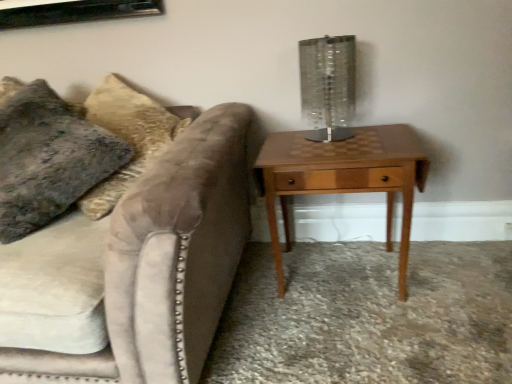
Image resolution: width=512 pixels, height=384 pixels. What do you see at coordinates (49, 158) in the screenshot? I see `velvety gray pillow at left` at bounding box center [49, 158].

What do you see at coordinates (343, 178) in the screenshot?
I see `woodenmaterial/texturenightstand at right` at bounding box center [343, 178].

Identify the location of velvet couch at left. (168, 258).

What do you see at coordinates (328, 86) in the screenshot? I see `clear glass table lamp at upper right` at bounding box center [328, 86].

Where is `velvety gray pillow at left`? The image size is (512, 384). velvety gray pillow at left is located at coordinates (49, 158).

Is woodenmaterial/texturenightstand at right next to clear glass table lamp at upper right?

No, woodenmaterial/texturenightstand at right is not with clear glass table lamp at upper right.

Is woodenmaterial/texturenightstand at right oriented away from clear glass table lamp at upper right?

woodenmaterial/texturenightstand at right does not have its back to clear glass table lamp at upper right.

Which is behind, point (402, 180) or point (333, 44)?

The point (333, 44) is farther from the camera.

Is velvety gray pillow at left facing towards woodenmaterial/texturenightstand at right?

No.

From the image's perspective, is velvety gray pillow at left above woodenmaterial/texturenightstand at right?

Correct, velvety gray pillow at left appears higher than woodenmaterial/texturenightstand at right in the image.

Which is nearer, (8, 137) or (324, 152)?

Point (8, 137) is positioned closer to the camera compared to point (324, 152).

In terms of height, does velvety gray pillow at left look taller or shorter compared to woodenmaterial/texturenightstand at right?

Clearly, velvety gray pillow at left is taller compared to woodenmaterial/texturenightstand at right.

Is clear glass table lamp at upper right inside or outside of velvet couch at left?

clear glass table lamp at upper right is located beyond the bounds of velvet couch at left.

Between clear glass table lamp at upper right and velvet couch at left, which one has larger size?

Bigger between the two is velvet couch at left.

Is point (333, 125) positioned after point (99, 354)?

That is True.

Considering the positions of objects velvet couch at left and woodenmaterial/texturenightstand at right in the image provided, who is more to the right, velvet couch at left or woodenmaterial/texturenightstand at right?

woodenmaterial/texturenightstand at right.

Considering the sizes of objects velvet couch at left and woodenmaterial/texturenightstand at right in the image provided, who is wider, velvet couch at left or woodenmaterial/texturenightstand at right?

With larger width is velvet couch at left.

From the image's perspective, who appears lower, velvet couch at left or woodenmaterial/texturenightstand at right?

velvet couch at left is shown below in the image.

Considering the sizes of objects velvet couch at left and woodenmaterial/texturenightstand at right in the image provided, who is smaller, velvet couch at left or woodenmaterial/texturenightstand at right?

woodenmaterial/texturenightstand at right is smaller.

Which is correct: woodenmaterial/texturenightstand at right is inside velvet couch at left, or outside of it?

woodenmaterial/texturenightstand at right lies outside velvet couch at left.

From a real-world perspective, is woodenmaterial/texturenightstand at right physically located above or below velvet couch at left?

woodenmaterial/texturenightstand at right is situated lower than velvet couch at left in the real world.

Considering the sizes of woodenmaterial/texturenightstand at right and velvet couch at left in the image, is woodenmaterial/texturenightstand at right taller or shorter than velvet couch at left?

Considering their sizes, woodenmaterial/texturenightstand at right has less height than velvet couch at left.

Locate an element on the screen. pillow lying above the woodenmaterial/texturenightstand at right (from the image's perspective) is located at coordinates (49, 158).

In the scene shown: From a real-world perspective, does woodenmaterial/texturenightstand at right sit lower than velvety gray pillow at left?

Yes.

Which object is more forward, woodenmaterial/texturenightstand at right or velvety gray pillow at left?

Positioned in front is velvety gray pillow at left.

Which is further, (274,255) or (70,186)?

The point (274,255) is farther.

Is velvet couch at left bigger than clear glass table lamp at upper right?

Correct, velvet couch at left is larger in size than clear glass table lamp at upper right.

Is velvet couch at left to the left of clear glass table lamp at upper right from the viewer's perspective?

Yes, velvet couch at left is to the left of clear glass table lamp at upper right.

How distant is velvet couch at left from clear glass table lamp at upper right?

A distance of 22.48 inches exists between velvet couch at left and clear glass table lamp at upper right.

Do you think velvet couch at left is within clear glass table lamp at upper right, or outside of it?

The correct answer is: outside.

At what (x,y) coordinates should I click in order to perform the action: click on table lamp on the left side of woodenmaterial/texturenightstand at right. Please return your answer as a coordinate pair (x, y). Looking at the image, I should click on (328, 86).

What are the coordinates of `nightstand below the velvety gray pillow at left (from a real-world perspective)` in the screenshot? It's located at (343, 178).

Looking at this image, which object lies further to the anchor point velvet couch at left, woodenmaterial/texturenightstand at right or velvety gray pillow at left?

woodenmaterial/texturenightstand at right.

When comparing their distances from woodenmaterial/texturenightstand at right, does clear glass table lamp at upper right or velvety gray pillow at left seem further?

velvety gray pillow at left lies further to woodenmaterial/texturenightstand at right than the other object.

Estimate the real-world distances between objects in this image. Which object is further from velvety gray pillow at left, velvet couch at left or clear glass table lamp at upper right?

Based on the image, clear glass table lamp at upper right appears to be further to velvety gray pillow at left.

Which object lies nearer to the anchor point velvet couch at left, velvety gray pillow at left or woodenmaterial/texturenightstand at right?

The object closer to velvet couch at left is velvety gray pillow at left.

When comparing their distances from velvet couch at left, does clear glass table lamp at upper right or velvety gray pillow at left seem closer?

The object closer to velvet couch at left is velvety gray pillow at left.

Estimate the real-world distances between objects in this image. Which object is closer to clear glass table lamp at upper right, velvet couch at left or woodenmaterial/texturenightstand at right?

woodenmaterial/texturenightstand at right is closer to clear glass table lamp at upper right.

Looking at the image, which one is located further to velvety gray pillow at left, clear glass table lamp at upper right or velvet couch at left?

Based on the image, clear glass table lamp at upper right appears to be further to velvety gray pillow at left.

Considering their positions, is woodenmaterial/texturenightstand at right positioned closer to clear glass table lamp at upper right than velvet couch at left?

Based on the image, woodenmaterial/texturenightstand at right appears to be nearer to clear glass table lamp at upper right.

The height and width of the screenshot is (384, 512). I want to click on studio couch between velvety gray pillow at left and woodenmaterial/texturenightstand at right from left to right, so click(x=168, y=258).

The width and height of the screenshot is (512, 384). I want to click on table lamp located between velvety gray pillow at left and woodenmaterial/texturenightstand at right in the left-right direction, so 328,86.

The image size is (512, 384). In order to click on table lamp between velvet couch at left and woodenmaterial/texturenightstand at right in this screenshot , I will do `click(328, 86)`.

Image resolution: width=512 pixels, height=384 pixels. What are the coordinates of `studio couch between velvety gray pillow at left and clear glass table lamp at upper right` in the screenshot? It's located at (168, 258).